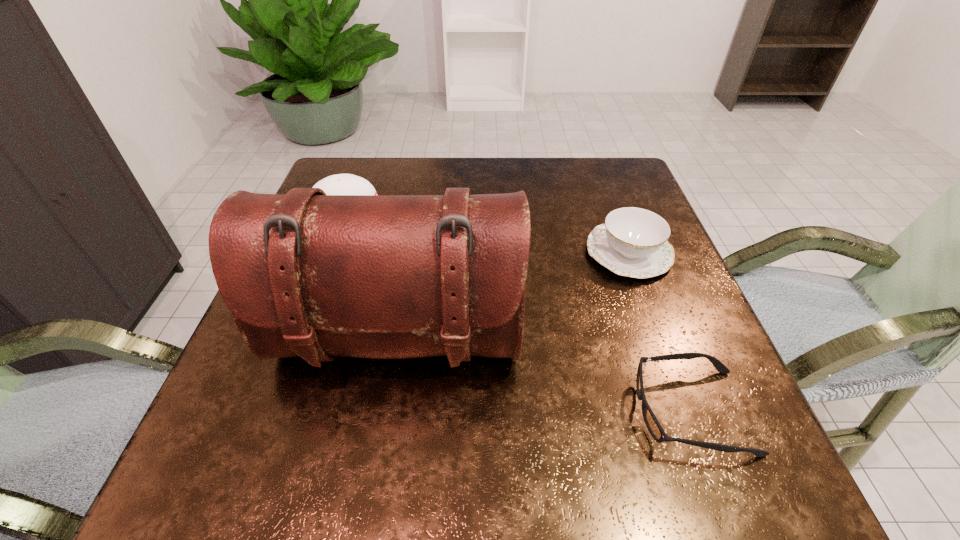
Where is `satchel`? satchel is located at coordinates (306, 274).

This screenshot has width=960, height=540. I want to click on the third shortest object, so click(340, 184).

Find the location of `chinaware`. chinaware is located at coordinates (633, 242).

This screenshot has height=540, width=960. What are the coordinates of `spectacles` in the screenshot? It's located at (652, 424).

Where is `free region located on the front-facing side of the satchel`? free region located on the front-facing side of the satchel is located at coordinates (384, 429).

Image resolution: width=960 pixels, height=540 pixels. What are the coordinates of `vacant space located on the front-facing side of the baseball cap` in the screenshot? It's located at (458, 215).

This screenshot has width=960, height=540. Identify the location of vacant space located on the handle side of the chinaware. (473, 253).

Where is `blank area located on the handle side of the chinaware`? Image resolution: width=960 pixels, height=540 pixels. blank area located on the handle side of the chinaware is located at coordinates (540, 253).

Where is `vacant area situated 0.400m on the handle side of the chinaware`? Image resolution: width=960 pixels, height=540 pixels. vacant area situated 0.400m on the handle side of the chinaware is located at coordinates (405, 253).

What are the coordinates of `vacant area situated 0.390m on the front-facing side of the shortest object` in the screenshot? It's located at (390, 411).